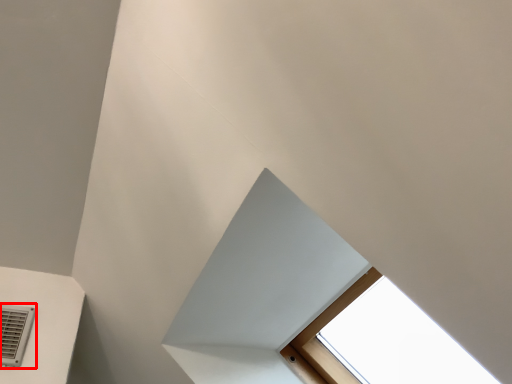
Question: From the image's perspective, what is the correct spatial relationship of air conditioning (annotated by the red box) in relation to exhaust hood?

Choices:
 (A) above
 (B) below

Answer: (B)